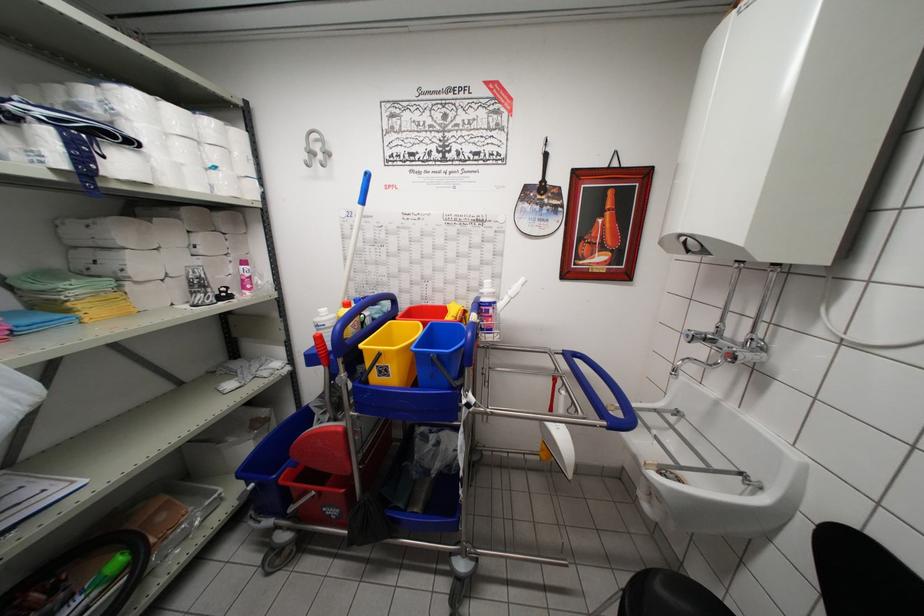
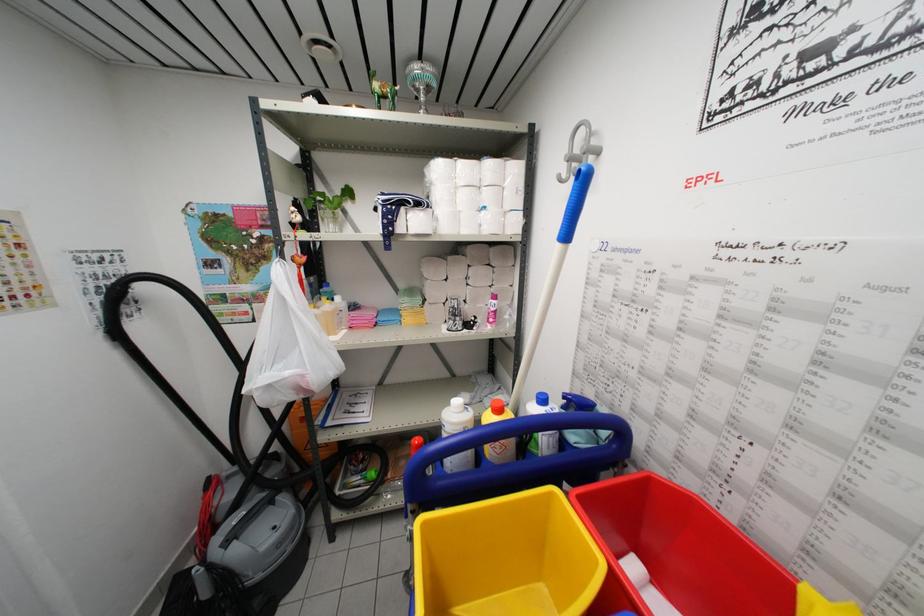
Where in the second image is the point corresponding to pixel 242 182 from the first image?

(507, 217)